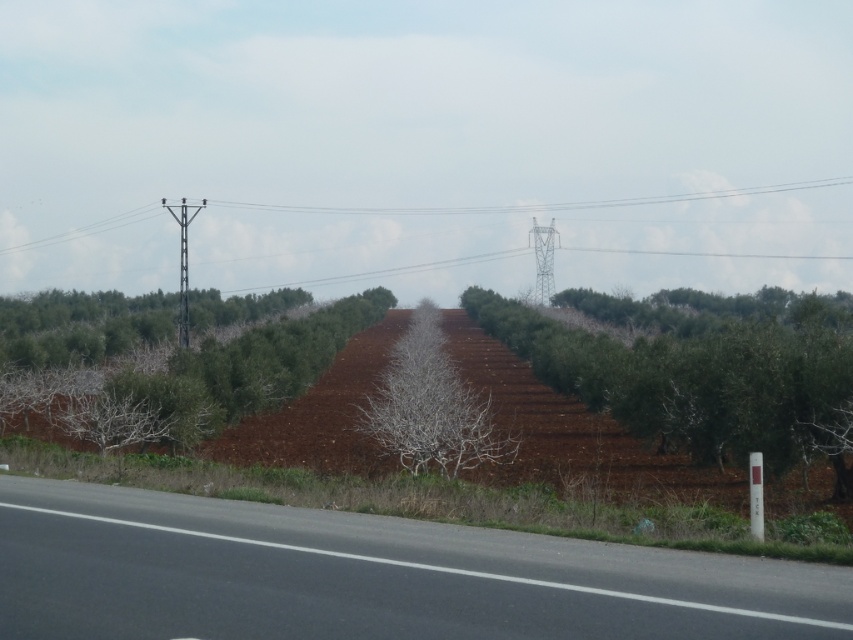
Does green leafy tree at center lie in front of metallic pole at center?

Yes, green leafy tree at center is in front of metallic pole at center.

Between point (560, 388) and point (187, 316), which one is positioned behind?

The point (187, 316) is more distant.

You are a GUI agent. You are given a task and a screenshot of the screen. Output one action in this format:
    pyautogui.click(x=<x>, y=<y>)
    Task: Click on the green leafy tree at center
    
    Given the screenshot: What is the action you would take?
    pyautogui.click(x=695, y=384)

Which is in front, point (105, 529) or point (535, 282)?

Point (105, 529) is more forward.

Can you confirm if black asphalt road at lower left is taller than metallic gray telegraph pole at center-right?

Incorrect, black asphalt road at lower left's height is not larger of metallic gray telegraph pole at center-right's.

Is point (206, 544) behind point (543, 266)?

No, it is not.

Find the location of a particular element. The width and height of the screenshot is (853, 640). black asphalt road at lower left is located at coordinates (367, 577).

Is green leafy tree at center taller than green leafy tree at left?

In fact, green leafy tree at center may be shorter than green leafy tree at left.

Does green leafy tree at center have a larger size compared to green leafy tree at left?

No.

Where is `green leafy tree at center`? The width and height of the screenshot is (853, 640). green leafy tree at center is located at coordinates (695, 384).